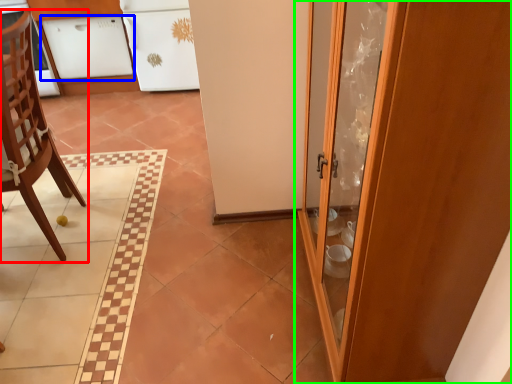
Question: Estimate the real-world distances between objects in this image. Which object is farther from chair (highlighted by a red box), cabinetry (highlighted by a blue box) or door (highlighted by a green box)?

Choices:
 (A) cabinetry
 (B) door

Answer: (A)